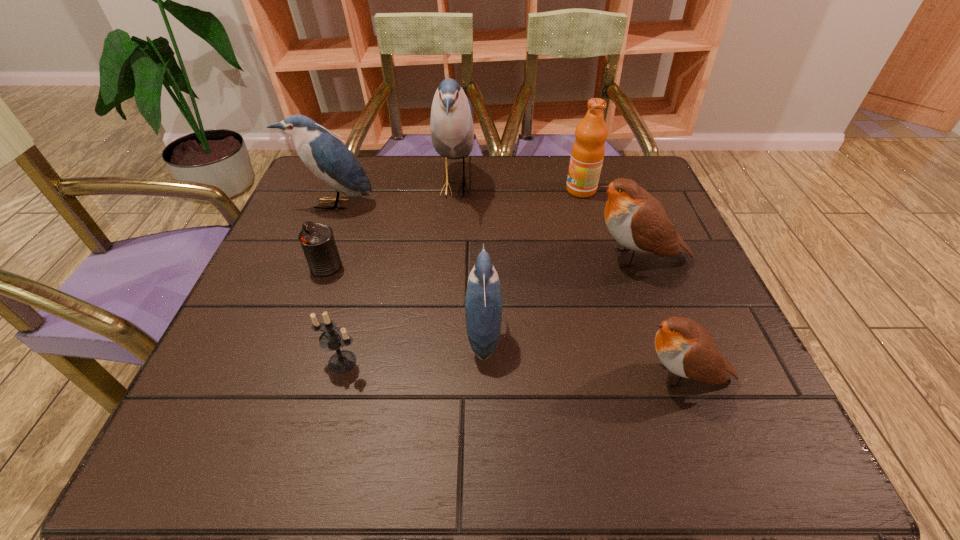
Where is `candle holder`? This screenshot has height=540, width=960. candle holder is located at coordinates (333, 338).

I want to click on can, so click(x=317, y=240).

Identify the location of vacant point located at the tip of the tallest bird's beak. This screenshot has width=960, height=540. (614, 187).

Locate an element on the screen. The height and width of the screenshot is (540, 960). vacant space located on the label side of the fruit juice is located at coordinates (458, 190).

The width and height of the screenshot is (960, 540). Find the location of `vacant region located 0.210m on the label side of the fruit juice`. vacant region located 0.210m on the label side of the fruit juice is located at coordinates (488, 190).

Identify the location of vacant space located on the label side of the fruit juice. (436, 190).

Where is `free space located at the tip of the fourth shortest bird's beak`? The image size is (960, 540). free space located at the tip of the fourth shortest bird's beak is located at coordinates (293, 307).

I want to click on vacant point located at the face of the third nearest bird, so click(x=416, y=258).

Image resolution: width=960 pixels, height=540 pixels. In order to click on free region located at the face of the third nearest bird in this screenshot , I will do `click(473, 258)`.

The height and width of the screenshot is (540, 960). In order to click on free space located at the face of the third nearest bird in this screenshot , I will do `click(416, 258)`.